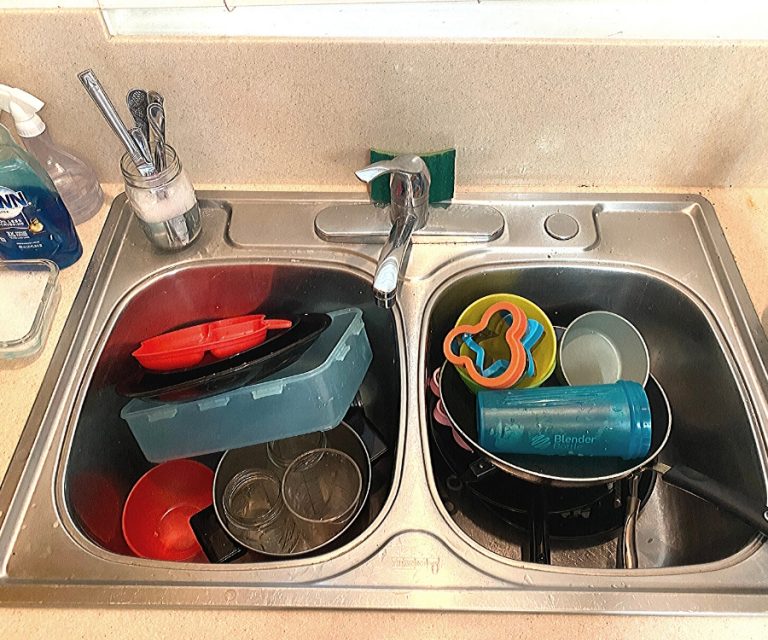
Locate an element on the screen. sink faucet is located at coordinates (384, 289), (392, 256), (408, 169).